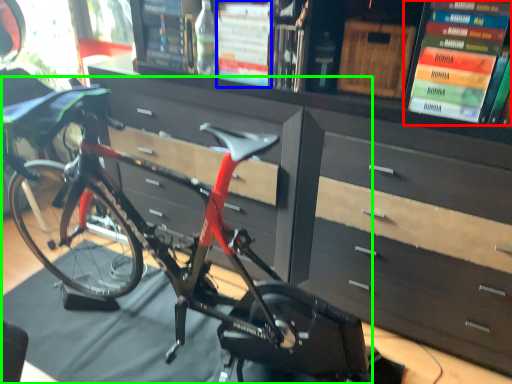
Question: Estimate the real-world distances between objects in this image. Which object is closer to book (highlighted by a red box), book (highlighted by a blue box) or bicycle (highlighted by a green box)?

Choices:
 (A) book
 (B) bicycle

Answer: (A)